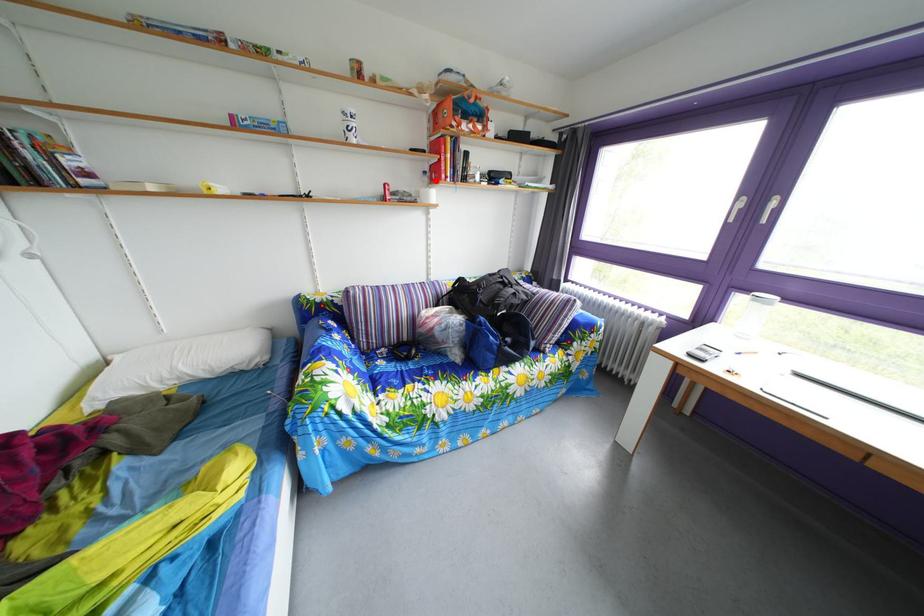
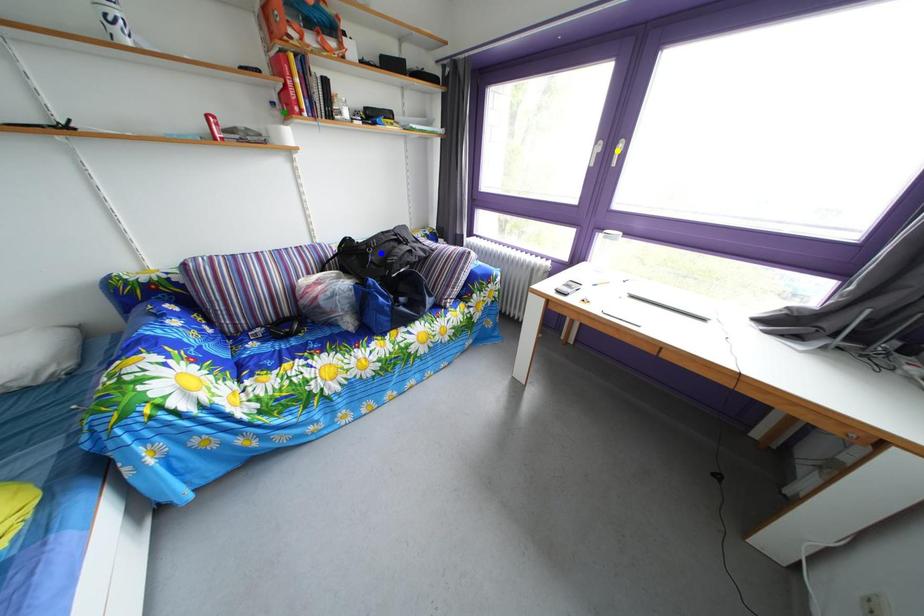
Question: I am providing you with two images of the same scene from different viewpoints. A red point is marked on the first image. You are given multiple points on the second image. In image 2, which mark is for the same physical point as the one in image 1?

Choices:
 (A) green point
 (B) blue point
 (C) yellow point

Answer: (A)